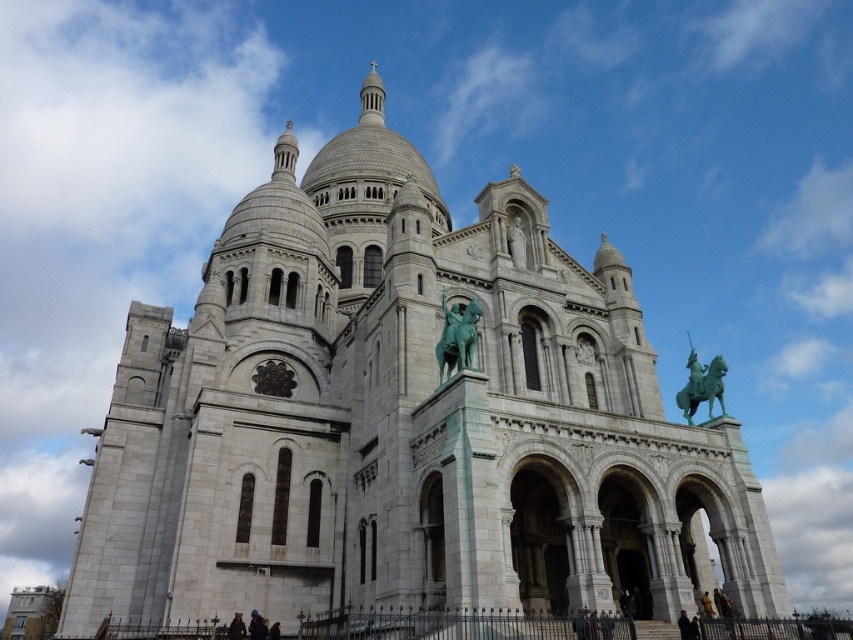
Which of these two, green patina statue at center or green patina horse at upper right, stands shorter?

green patina statue at center

Measure the distance from green patina statue at center to green patina horse at upper right.

27.91 meters

Is point (457, 340) positioned after point (722, 376)?

No, it is in front of (722, 376).

This screenshot has height=640, width=853. I want to click on green patina statue at center, so click(x=457, y=337).